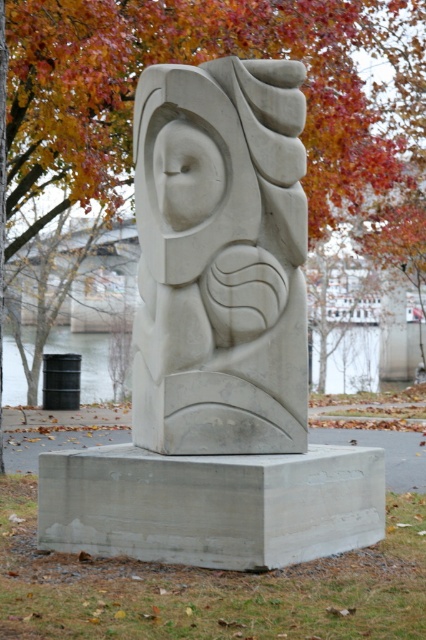
Question: Does white stone owl at center have a smaller size compared to orange leafy tree at upper center?

Choices:
 (A) yes
 (B) no

Answer: (B)

Question: Which object is closer to the camera taking this photo?

Choices:
 (A) orange leafy tree at upper center
 (B) white stone owl at center

Answer: (B)

Question: In this image, where is white stone owl at center located relative to orange leafy tree at upper center?

Choices:
 (A) below
 (B) above

Answer: (A)

Question: In this image, where is white stone owl at center located relative to orange leafy tree at upper center?

Choices:
 (A) above
 (B) below

Answer: (B)

Question: Among these points, which one is nearest to the camera?

Choices:
 (A) click(x=270, y=428)
 (B) click(x=324, y=192)

Answer: (A)